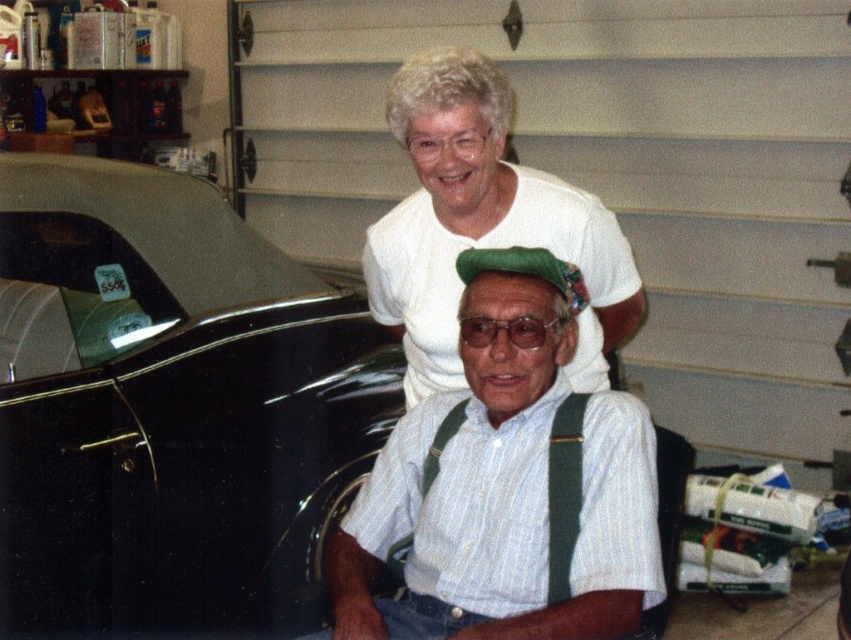
Question: Can you confirm if black glossy car at left is positioned above green fabric suspenders at center?

Choices:
 (A) yes
 (B) no

Answer: (A)

Question: In this image, where is white striped shirt at center located relative to white matte t-shirt at upper center?

Choices:
 (A) above
 (B) below

Answer: (B)

Question: Which is farther from the green fabric suspenders at center?

Choices:
 (A) black glossy car at left
 (B) white striped shirt at center
 (C) white matte t-shirt at upper center

Answer: (A)

Question: Among these objects, which one is nearest to the camera?

Choices:
 (A) white striped shirt at center
 (B) white matte t-shirt at upper center

Answer: (A)

Question: Does white striped shirt at center have a smaller size compared to white matte t-shirt at upper center?

Choices:
 (A) no
 (B) yes

Answer: (B)

Question: Which object is closer to the camera taking this photo?

Choices:
 (A) white matte t-shirt at upper center
 (B) green fabric suspenders at center

Answer: (B)